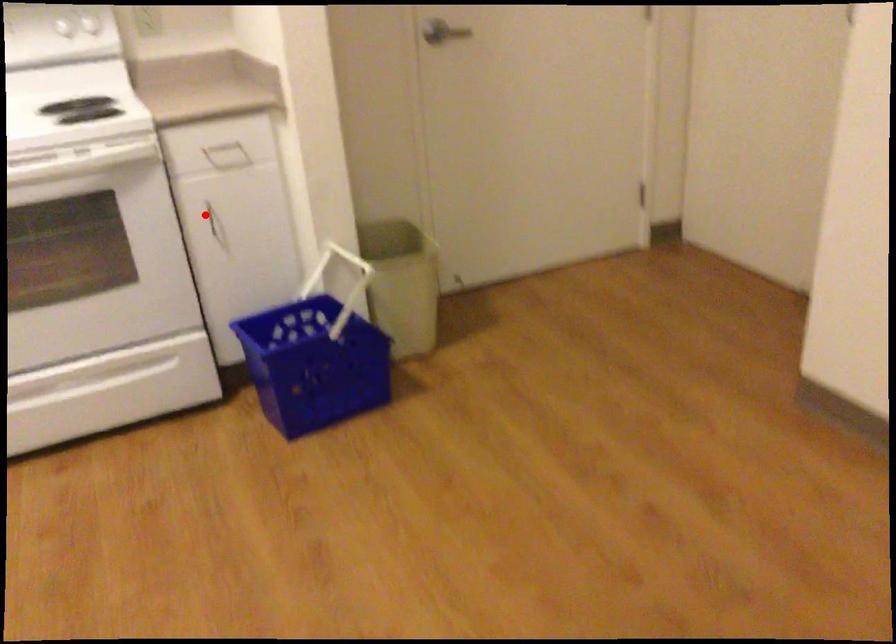
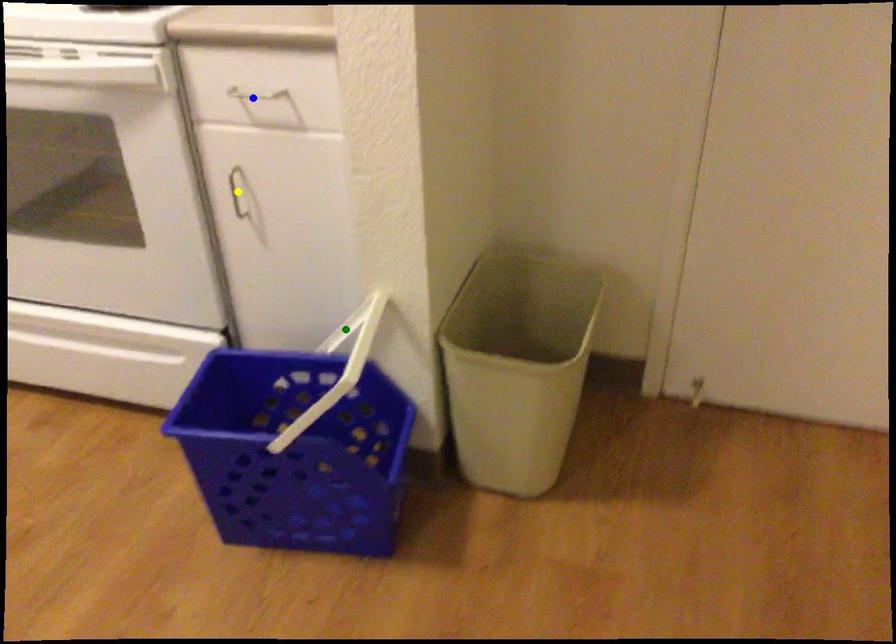
Question: I am providing you with two images of the same scene from different viewpoints. A red point is marked on the first image. You are given multiple points on the second image. Can you choose the point in image 2 that corresponds to the point in image 1?

Choices:
 (A) yellow point
 (B) green point
 (C) blue point

Answer: (A)